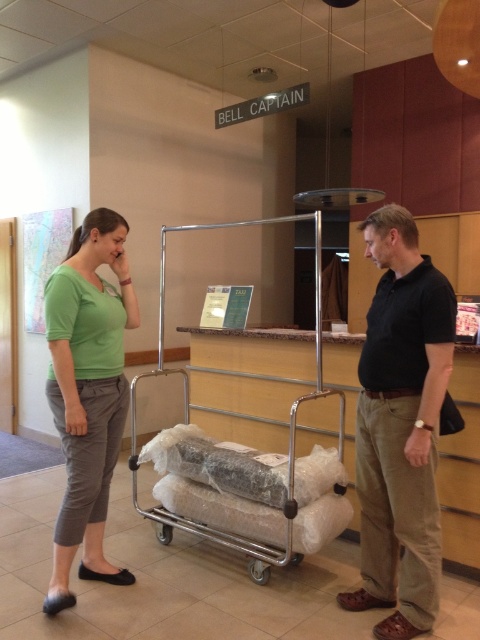
Question: Does green matte shirt at left appear on the left side of silver metallic luggage cart at center?

Choices:
 (A) yes
 (B) no

Answer: (A)

Question: Which object is positioned farthest from the black cotton shirt at center?

Choices:
 (A) green matte shirt at left
 (B) silver metallic luggage cart at center

Answer: (A)

Question: Can you confirm if black cotton shirt at center is bigger than silver metallic luggage cart at center?

Choices:
 (A) yes
 (B) no

Answer: (B)

Question: Which of the following is the closest to the observer?

Choices:
 (A) (74, 500)
 (B) (379, 189)
 (C) (434, 321)

Answer: (C)

Question: Does green matte shirt at left have a larger size compared to silver metallic luggage cart at center?

Choices:
 (A) yes
 (B) no

Answer: (B)

Question: Which point is farther to the camera?

Choices:
 (A) pos(361,358)
 (B) pos(56,541)
 (C) pos(132,420)

Answer: (C)